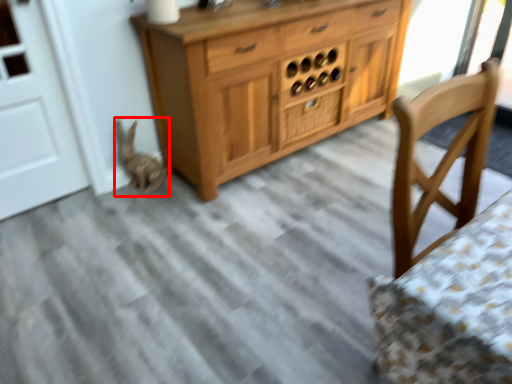
Question: From the image's perspective, what is the correct spatial positioning of animal (annotated by the red box) in reference to drawer?

Choices:
 (A) above
 (B) below

Answer: (B)